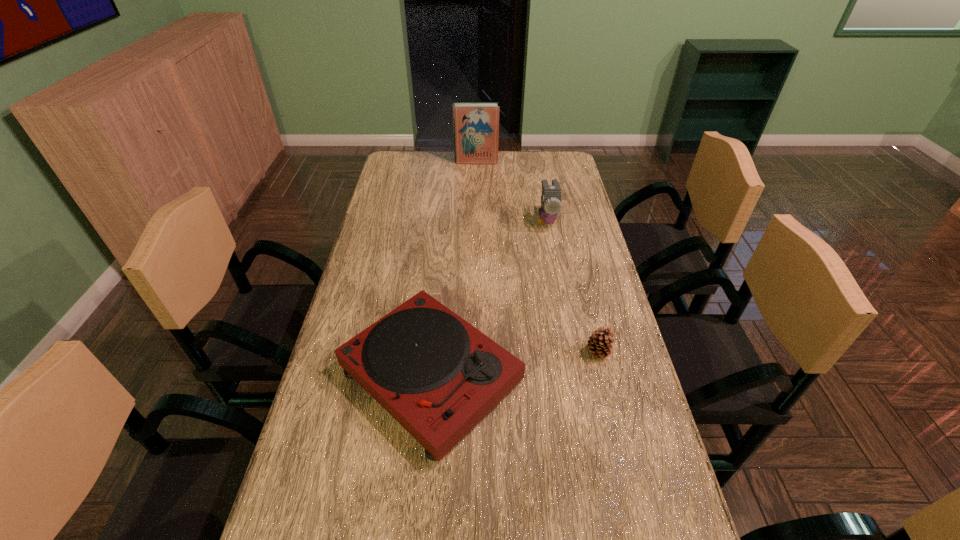
Locate an element on the screen. object located at the far edge is located at coordinates (476, 125).

At what (x,y) coordinates should I click in order to perform the action: click on object present at the left edge. Please return your answer as a coordinate pair (x, y). The image size is (960, 540). Looking at the image, I should click on (438, 376).

You are a GUI agent. You are given a task and a screenshot of the screen. Output one action in this format:
    pyautogui.click(x=<x>, y=<y>)
    Task: Click on the bird that is at the right edge
    This screenshot has height=540, width=960.
    Given the screenshot: What is the action you would take?
    pyautogui.click(x=551, y=194)

Locate an element on the screen. pinecone that is positioned at the right edge is located at coordinates (599, 343).

In the image, there is a desktop. What are the coordinates of `blank space at the far edge` in the screenshot? It's located at (438, 155).

The width and height of the screenshot is (960, 540). What are the coordinates of `free region at the left edge of the desktop` in the screenshot? It's located at (395, 186).

In the image, there is a desktop. At what (x,y) coordinates should I click in order to perform the action: click on vacant space at the right edge. Please return your answer as a coordinate pair (x, y). Image resolution: width=960 pixels, height=540 pixels. Looking at the image, I should click on point(597,418).

At what (x,y) coordinates should I click in order to perform the action: click on vacant region at the far left corner of the desktop. Please return your answer as a coordinate pair (x, y). Looking at the image, I should click on (393, 163).

In the image, there is a desktop. Identify the location of vacant space at the far right corner. This screenshot has height=540, width=960. (551, 157).

I want to click on vacant area that lies between the third shortest object and the rightmost object, so click(572, 286).